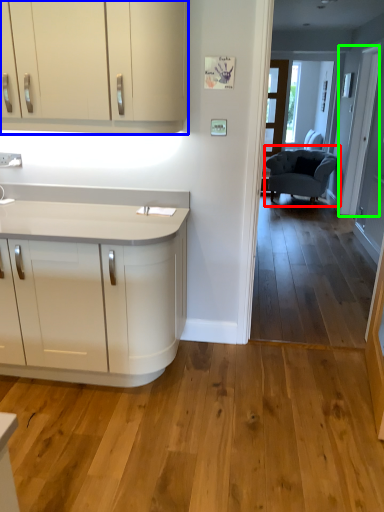
Question: Which object is the closest to the chair (highlighted by a red box)? Choose among these: cabinetry (highlighted by a blue box) or door (highlighted by a green box).

Choices:
 (A) cabinetry
 (B) door

Answer: (B)